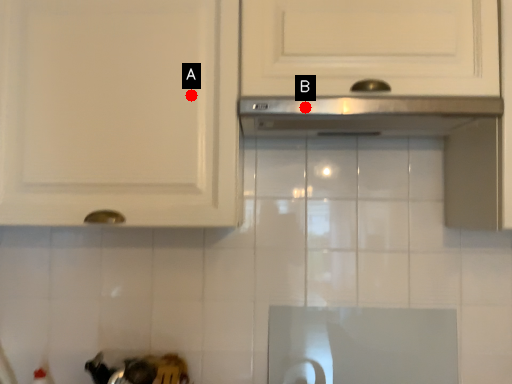
Question: Two points are circled on the image, labeled by A and B beside each circle. Which point appears farthest from the camera in this image?

Choices:
 (A) A is further
 (B) B is further

Answer: (A)